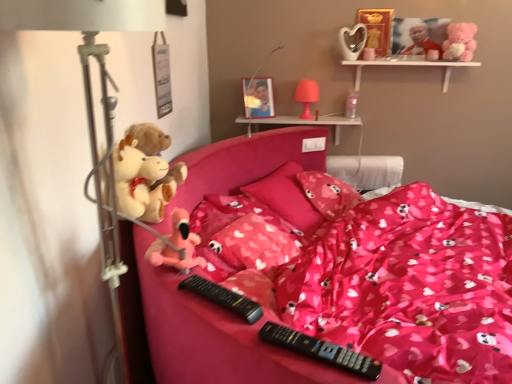
Find the location of a particular element. The width and height of the screenshot is (512, 384). vacant space situated above pink plastic shelf at upper center, the 2th shelf viewed from the top (from a real-world perspective) is located at coordinates (310, 118).